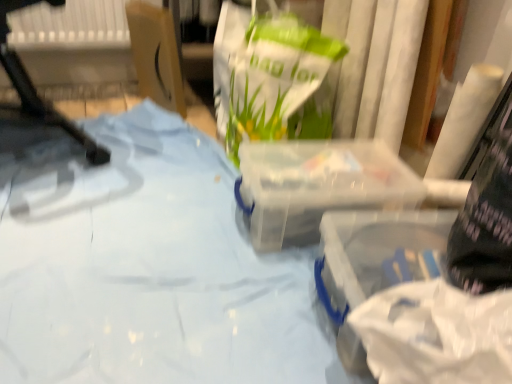
Question: From the image's perspective, is cardboard box at upper left over blue fabric at center?

Choices:
 (A) yes
 (B) no

Answer: (A)

Question: From a real-world perspective, is cardboard box at upper left positioned under blue fabric at center based on gravity?

Choices:
 (A) yes
 (B) no

Answer: (B)

Question: Can you confirm if cardboard box at upper left is shorter than blue fabric at center?

Choices:
 (A) no
 (B) yes

Answer: (A)

Question: Can you confirm if cardboard box at upper left is smaller than blue fabric at center?

Choices:
 (A) yes
 (B) no

Answer: (A)

Question: Can you confirm if cardboard box at upper left is taller than blue fabric at center?

Choices:
 (A) no
 (B) yes

Answer: (B)

Question: Does cardboard box at upper left turn towards blue fabric at center?

Choices:
 (A) yes
 (B) no

Answer: (B)

Question: From the image's perspective, is cardboard box at upper left over white plastic chair at left?

Choices:
 (A) no
 (B) yes

Answer: (B)

Question: Does cardboard box at upper left touch white plastic chair at left?

Choices:
 (A) yes
 (B) no

Answer: (B)

Question: Is white plastic chair at left surrounded by cardboard box at upper left?

Choices:
 (A) no
 (B) yes

Answer: (A)

Question: Would you say cardboard box at upper left is outside white plastic chair at left?

Choices:
 (A) no
 (B) yes

Answer: (B)

Question: Is cardboard box at upper left thinner than white plastic chair at left?

Choices:
 (A) yes
 (B) no

Answer: (A)

Question: From a real-world perspective, is cardboard box at upper left located beneath white plastic chair at left?

Choices:
 (A) no
 (B) yes

Answer: (B)

Question: Is white plastic chair at left looking in the opposite direction of blue fabric at center?

Choices:
 (A) no
 (B) yes

Answer: (A)